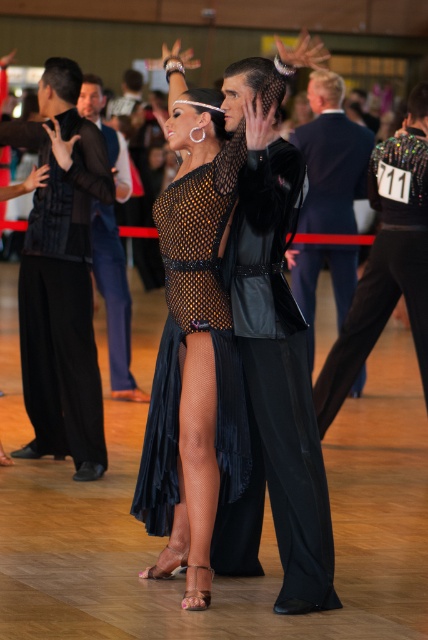
Question: Which object is the closest to the velvet suit at center?

Choices:
 (A) black velvet vest at left
 (B) velvet black suit at center
 (C) velvet suit at right
 (D) matte black dress at center

Answer: (C)

Question: Which point appears farthest from the camera in this image?

Choices:
 (A) (65, 131)
 (B) (240, 369)

Answer: (A)

Question: Does black velvet vest at left have a greater width compared to velvet suit at right?

Choices:
 (A) yes
 (B) no

Answer: (B)

Question: Which point is farther from the camera taking this photo?

Choices:
 (A) click(115, 321)
 (B) click(172, 224)
 (C) click(300, 289)
 (D) click(382, 272)

Answer: (C)

Question: Is black velvet vest at left closer to camera compared to velvet black suit at center?

Choices:
 (A) yes
 (B) no

Answer: (A)

Question: In this image, where is matte black dress at center located relative to velvet suit at center?

Choices:
 (A) right
 (B) left

Answer: (B)